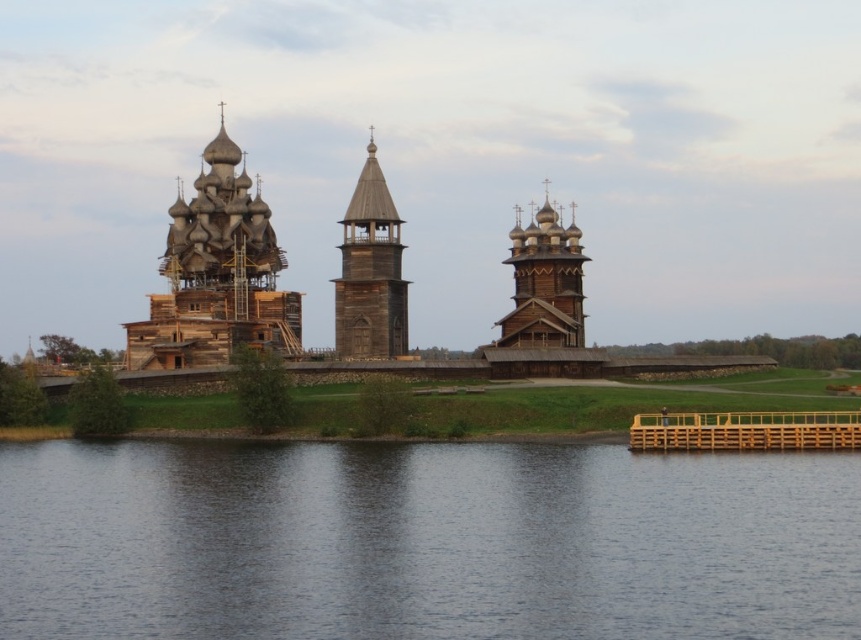
You are standing at the entrance of the lakeside complex and want to take a photo of the wooden church at left and the wooden tower at center. Since you want both in the frame, which direction should you face to ensure both are visible?

You should face to the right to include both the wooden church at left and the wooden tower at center in your photo, since the wooden church at left is positioned to the left of the wooden tower at center.

You are standing at the viewpoint of the image and want to know which of the two points, point [381,192] or point [555,273], is nearer to you. Can you tell me which one is closer?

Point [381,192] is closer to the camera than point [555,273], so it is the nearer one.